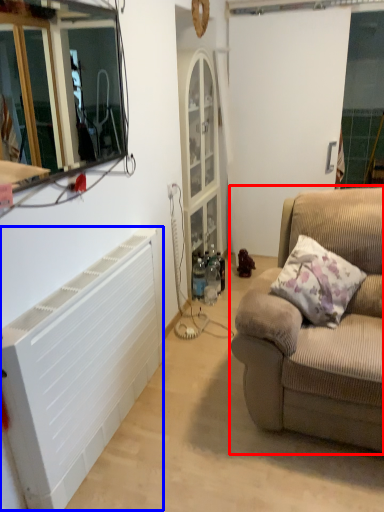
Question: Which of the following is the closest to the observer, studio couch (highlighted by a red box) or air conditioning (highlighted by a blue box)?

Choices:
 (A) studio couch
 (B) air conditioning

Answer: (B)